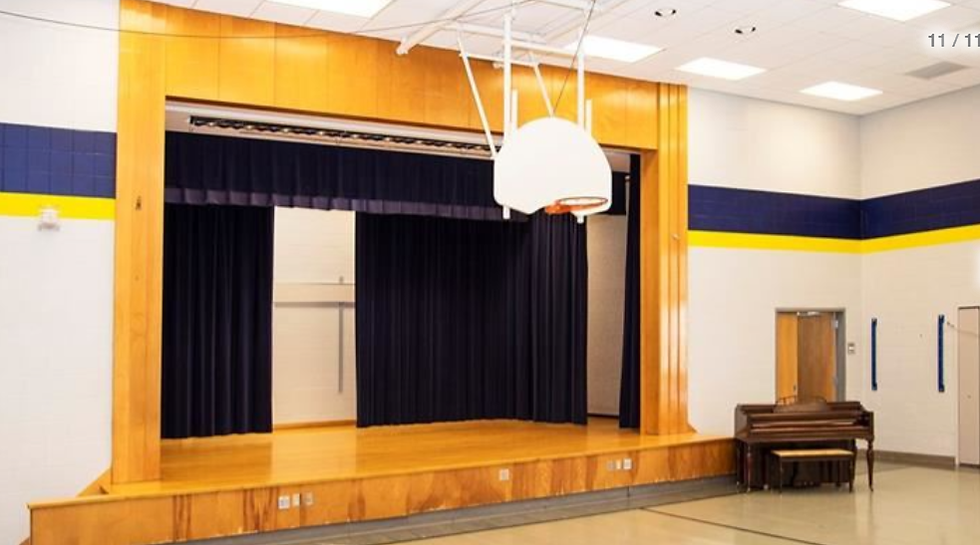
I want to click on ceiling, so click(790, 53).